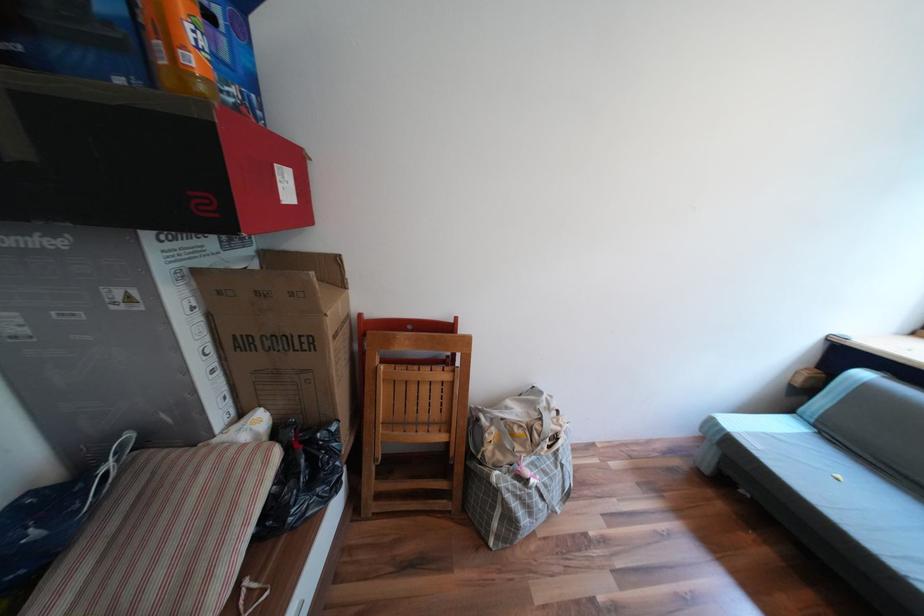
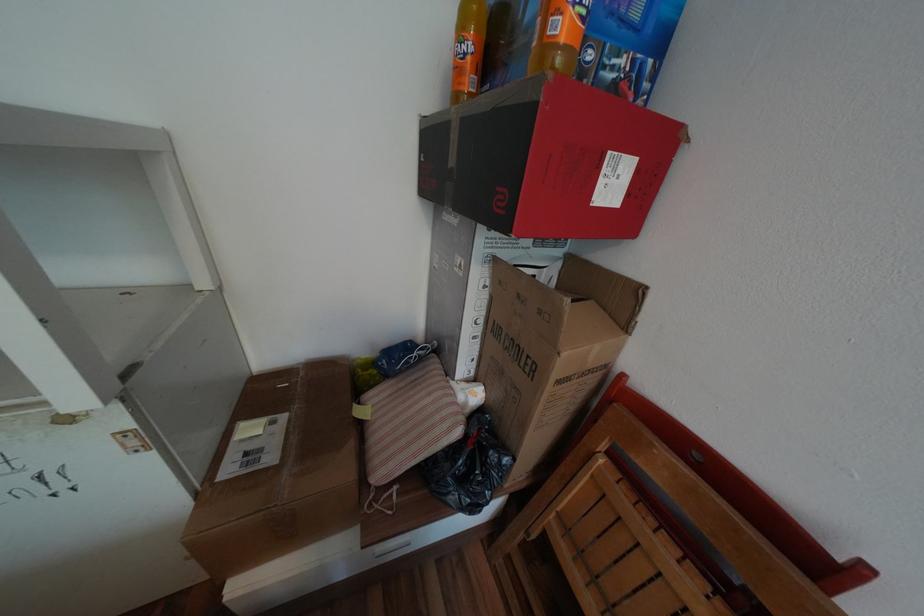
Where in the second image is the point corresponding to point (327, 435) from the first image?

(500, 453)